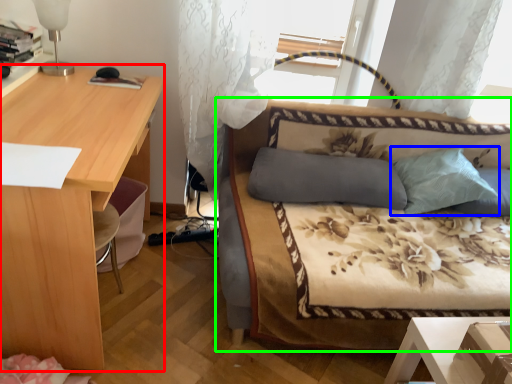
Question: Which object is positioned farthest from desk (highlighted by a red box)? Select from pillow (highlighted by a blue box) and studio couch (highlighted by a green box).

Choices:
 (A) pillow
 (B) studio couch

Answer: (A)